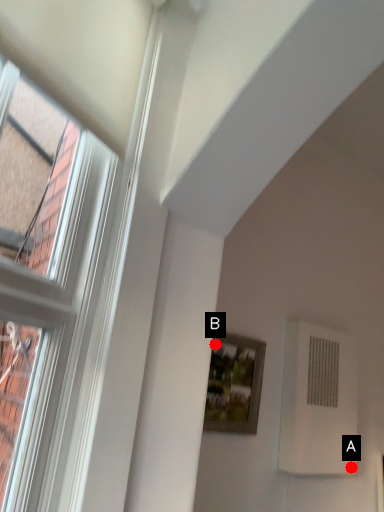
Question: Two points are circled on the image, labeled by A and B beside each circle. Which point is closer to the camera?

Choices:
 (A) A is closer
 (B) B is closer

Answer: (B)